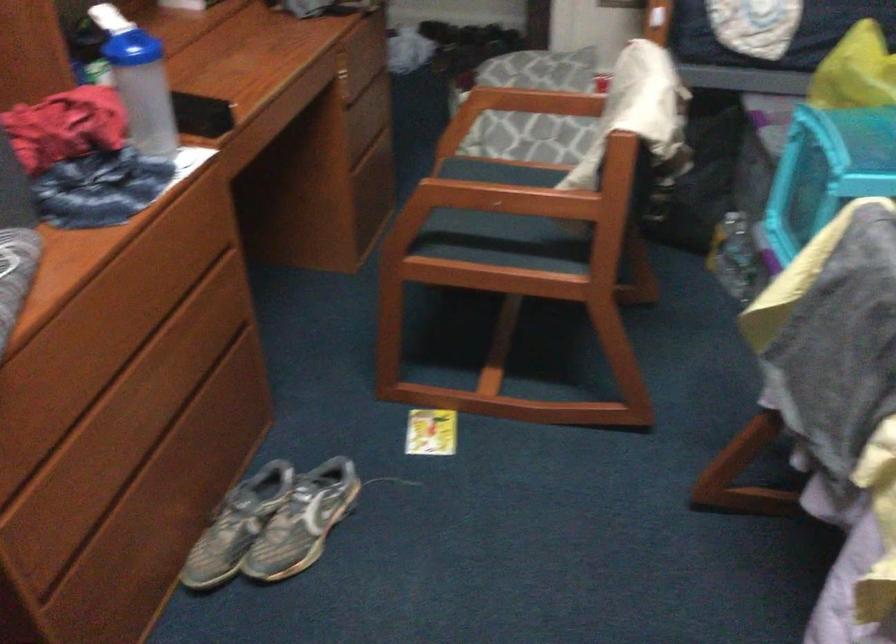
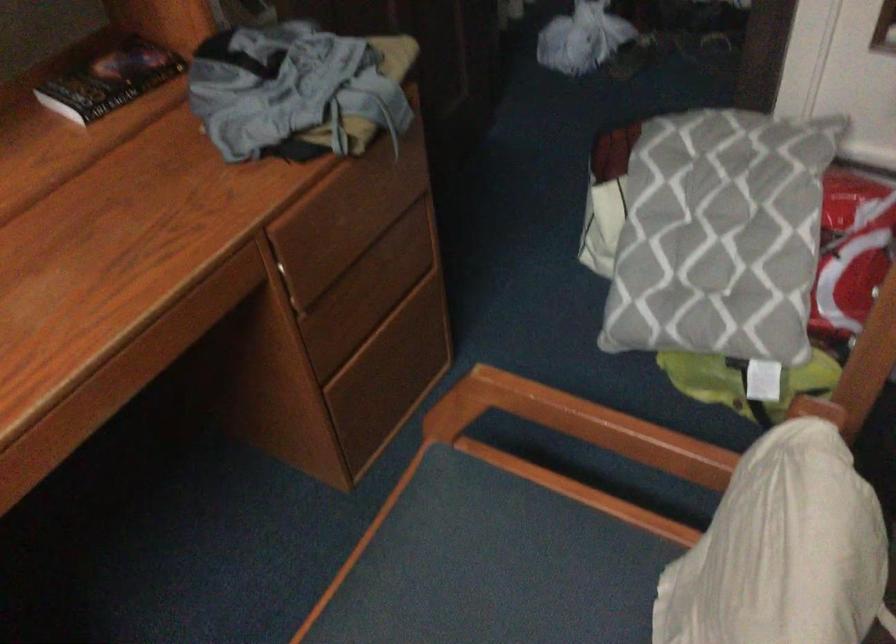
Question: The images are taken continuously from a first-person perspective. In which direction are you moving?

Choices:
 (A) Left
 (B) Right
 (C) Forward
 (D) Backward

Answer: (C)